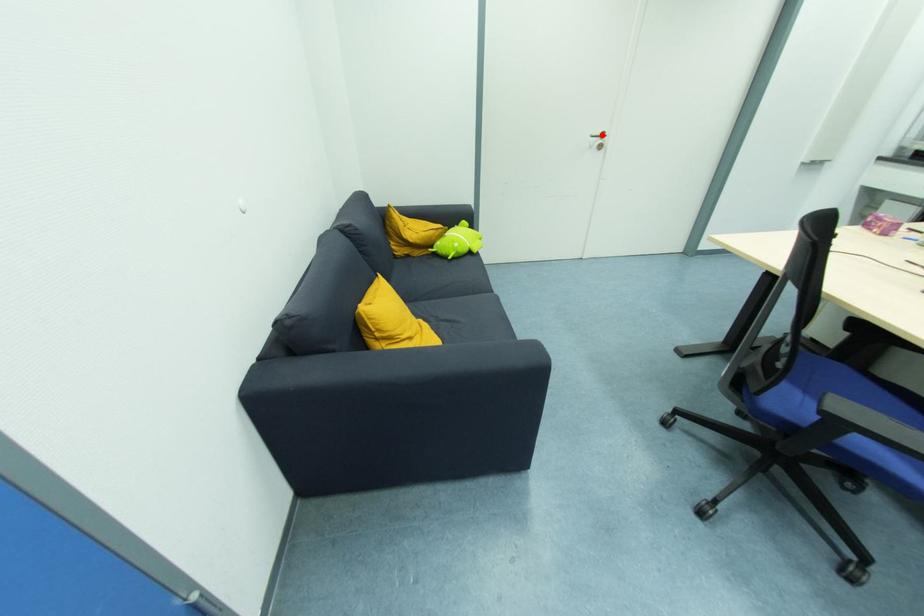
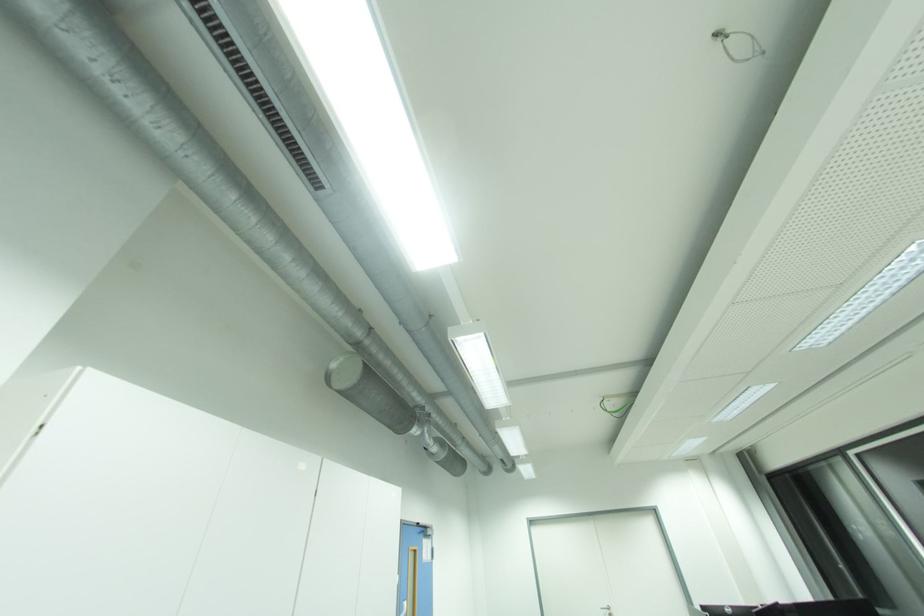
Where in the second image is the point corresponding to the highlighted location from the first image?

(610, 609)